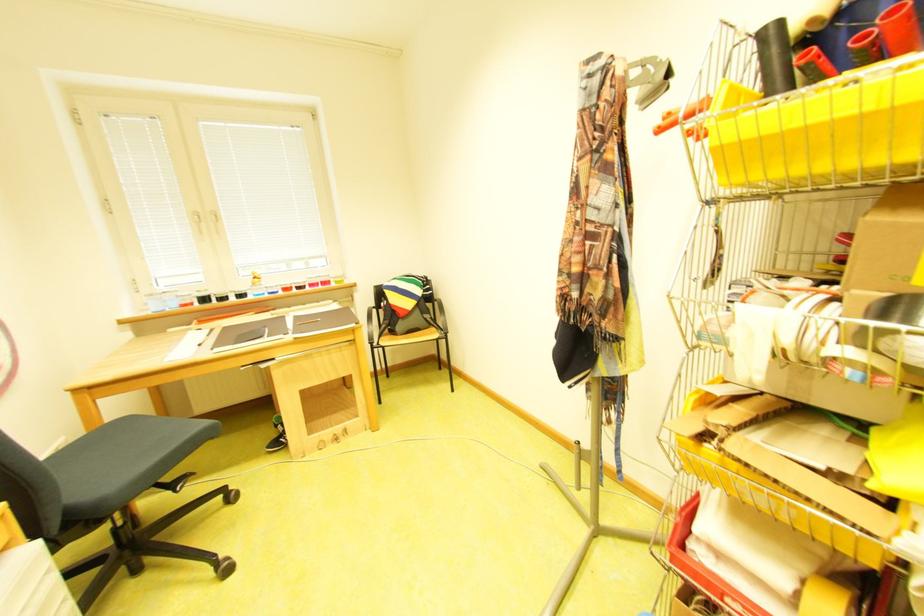
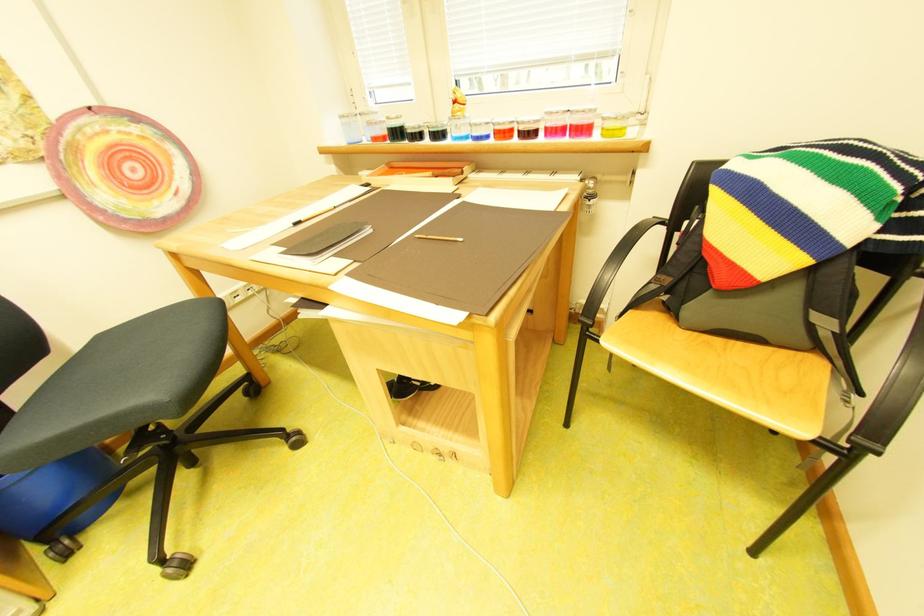
In the second image, find the point that corresponds to pixel 264 285 in the first image.

(465, 115)